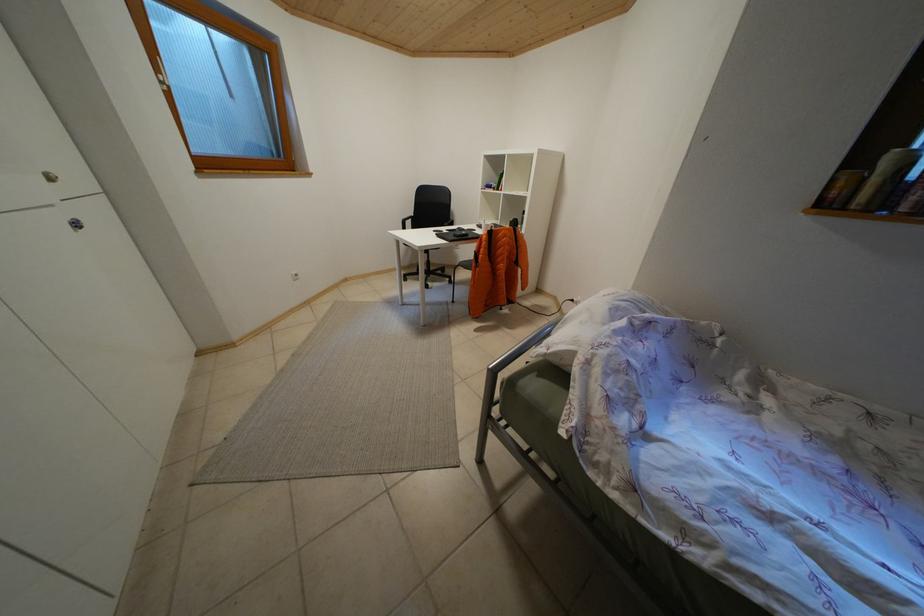
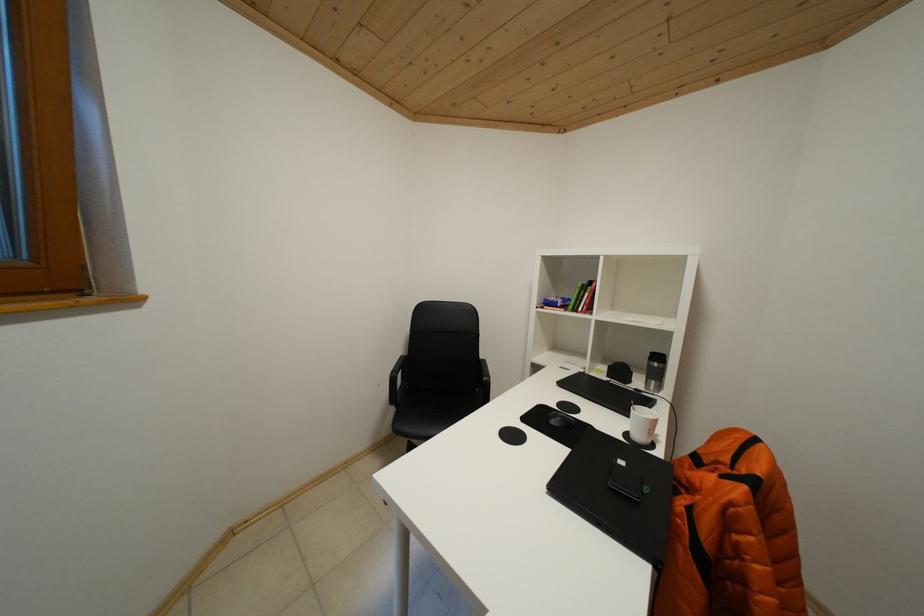
What movement of the cameraman would produce the second image?

The cameraman walked toward left, forward.